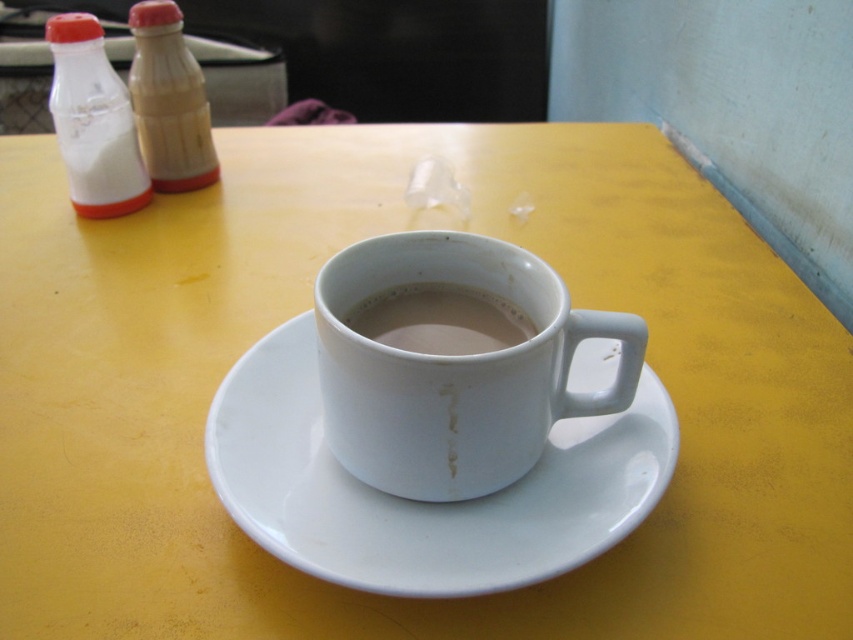
Question: Does white plastic bottle at left have a larger size compared to matte plastic bottle at left?

Choices:
 (A) no
 (B) yes

Answer: (B)

Question: Which point appears closest to the camera in this image?

Choices:
 (A) (630, 340)
 (B) (413, 292)

Answer: (A)

Question: Can you confirm if matte plastic bottle at left is smaller than white matte cup at center?

Choices:
 (A) yes
 (B) no

Answer: (B)

Question: Which of these objects is positioned closest to the matte plastic bottle at left?

Choices:
 (A) white glossy mug at center
 (B) white ceramic saucer at center
 (C) white matte cup at center
 (D) white plastic bottle at left

Answer: (D)

Question: Does white glossy mug at center come behind white matte cup at center?

Choices:
 (A) yes
 (B) no

Answer: (B)

Question: Considering the real-world distances, which object is farthest from the white glossy mug at center?

Choices:
 (A) white plastic bottle at left
 (B) white ceramic saucer at center

Answer: (A)